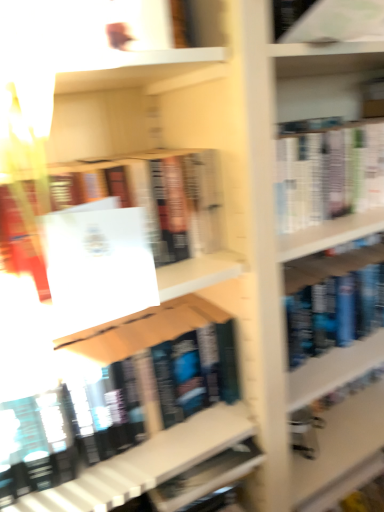
Question: Which direction should I rotate to face matte black book at center, which appears as the first book when ordered from the bottom, — up or down?

Choices:
 (A) down
 (B) up

Answer: (A)

Question: Is white paper at upper right, which appears as the first book when viewed from the top, facing towards white paper at upper center, which is the second book from bottom to top?

Choices:
 (A) no
 (B) yes

Answer: (A)

Question: Is white paper at upper right, which appears as the first book when viewed from the top, smaller than white paper at upper center, which is the second book from bottom to top?

Choices:
 (A) yes
 (B) no

Answer: (A)

Question: Considering the relative sizes of white paper at upper right, which appears as the first book when viewed from the top, and white paper at upper center, the second book from the top, in the image provided, is white paper at upper right, which appears as the first book when viewed from the top, shorter than white paper at upper center, the second book from the top,?

Choices:
 (A) no
 (B) yes

Answer: (B)

Question: Does white paper at upper right, the 3th book in the bottom-to-top sequence, appear on the left side of white paper at upper center, which is the second book from bottom to top?

Choices:
 (A) no
 (B) yes

Answer: (A)

Question: Can you confirm if white paper at upper right, which appears as the first book when viewed from the top, is thinner than white paper at upper center, which is the second book from bottom to top?

Choices:
 (A) yes
 (B) no

Answer: (B)

Question: From a real-world perspective, is white paper at upper right, the 3th book in the bottom-to-top sequence, on white paper at upper center, which is the second book from bottom to top?

Choices:
 (A) yes
 (B) no

Answer: (A)

Question: Does white paper at upper right, the 3th book in the bottom-to-top sequence, appear on the right side of matte black book at center, which appears as the first book when ordered from the bottom?

Choices:
 (A) no
 (B) yes

Answer: (B)

Question: From the image's perspective, is white paper at upper right, which appears as the first book when viewed from the top, over matte black book at center, which appears as the first book when ordered from the bottom?

Choices:
 (A) yes
 (B) no

Answer: (A)

Question: Is the depth of white paper at upper right, which appears as the first book when viewed from the top, greater than that of matte black book at center, marked as the third book in a top-to-bottom arrangement?

Choices:
 (A) no
 (B) yes

Answer: (B)

Question: Is white paper at upper right, the 3th book in the bottom-to-top sequence, to the left of matte black book at center, marked as the third book in a top-to-bottom arrangement, from the viewer's perspective?

Choices:
 (A) yes
 (B) no

Answer: (B)

Question: Is white paper at upper right, which appears as the first book when viewed from the top, thinner than matte black book at center, which appears as the first book when ordered from the bottom?

Choices:
 (A) yes
 (B) no

Answer: (A)

Question: Is white paper at upper right, the 3th book in the bottom-to-top sequence, shorter than matte black book at center, marked as the third book in a top-to-bottom arrangement?

Choices:
 (A) yes
 (B) no

Answer: (A)

Question: Is white matte paper at center looking in the opposite direction of white paper at upper right, the 3th book in the bottom-to-top sequence?

Choices:
 (A) yes
 (B) no

Answer: (B)